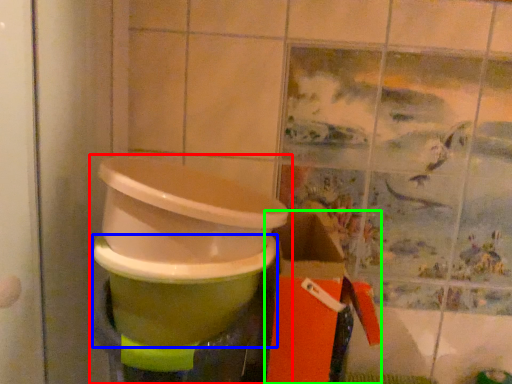
Question: Which object is positioned closest to waste container (highlighted by a red box)? Select from toilet bowl (highlighted by a blue box) and box (highlighted by a green box).

Choices:
 (A) toilet bowl
 (B) box

Answer: (A)